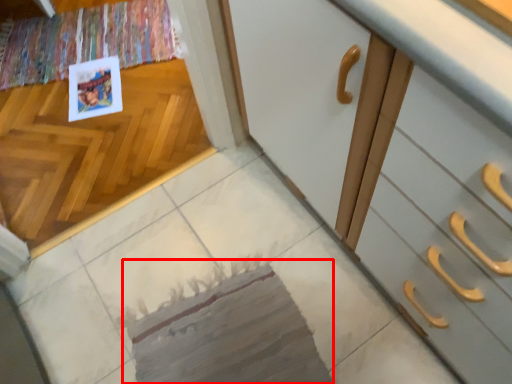
Question: From the image's perspective, where is mat (annotated by the red box) located in relation to postcard in the image?

Choices:
 (A) below
 (B) above

Answer: (A)